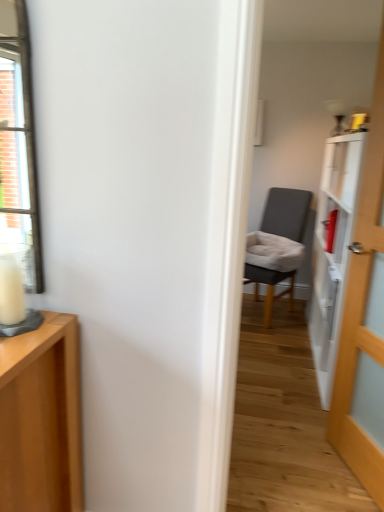
At what (x,y) coordinates should I click in order to perform the action: click on dark gray fabric chair at center. Please return your answer as a coordinate pair (x, y). Looking at the image, I should click on (286, 213).

The width and height of the screenshot is (384, 512). Identify the location of wooden door at right. (364, 314).

In order to face white wax candle at left, should I rotate leftwards or rightwards?

A 23.315 degree turn to the left will do.

Find the location of `dark gray fabric chair at center`. dark gray fabric chair at center is located at coordinates (286, 213).

Could you tell me if white wax candle at left is facing dark gray fabric chair at center?

No, white wax candle at left is not facing towards dark gray fabric chair at center.

Can you confirm if white wax candle at left is positioned to the right of dark gray fabric chair at center?

In fact, white wax candle at left is to the left of dark gray fabric chair at center.

How many degrees apart are the facing directions of white wax candle at left and dark gray fabric chair at center?

white wax candle at left and dark gray fabric chair at center are facing 28 degrees away from each other.

In terms of height, does white wax candle at left look taller or shorter compared to dark gray fabric chair at center?

In the image, white wax candle at left appears to be shorter than dark gray fabric chair at center.

Is wooden door at right facing away from white wax candle at left?

No, wooden door at right is not facing the opposite direction of white wax candle at left.

Does wooden door at right have a larger size compared to white wax candle at left?

Yes.

Can you confirm if wooden door at right is taller than white wax candle at left?

Correct, wooden door at right is much taller as white wax candle at left.

Locate an element on the screen. door located on the right of white wax candle at left is located at coordinates (364, 314).

Which object is further away from the camera taking this photo, dark gray fabric chair at center or white wax candle at left?

dark gray fabric chair at center.

Can you confirm if dark gray fabric chair at center is taller than white wax candle at left?

Yes, dark gray fabric chair at center is taller than white wax candle at left.

Which point is more distant from viewer, (271,304) or (11,265)?

The point (271,304) is farther from the camera.

Which of these two, dark gray fabric chair at center or white wax candle at left, is smaller?

Smaller between the two is white wax candle at left.

How many degrees apart are the facing directions of dark gray fabric chair at center and wooden door at right?

The facing directions of dark gray fabric chair at center and wooden door at right are 39.6 degrees apart.

From a real-world perspective, is dark gray fabric chair at center positioned under wooden door at right based on gravity?

Indeed, from a real-world perspective, dark gray fabric chair at center is positioned beneath wooden door at right.

Is dark gray fabric chair at center bigger than wooden door at right?

Indeed, dark gray fabric chair at center has a larger size compared to wooden door at right.

Considering the points (268, 199) and (375, 122), which point is behind, point (268, 199) or point (375, 122)?

The point (268, 199) is farther.

Which of these two, white wax candle at left or wooden door at right, stands taller?

With more height is wooden door at right.

At what (x,y) coordinates should I click in order to perform the action: click on candle that appears below the wooden door at right (from the image's perspective). Please return your answer as a coordinate pair (x, y). Looking at the image, I should click on (11, 292).

How different are the orientations of white wax candle at left and wooden door at right in degrees?

The angle between the facing direction of white wax candle at left and the facing direction of wooden door at right is 67.6 degrees.

Between wooden door at right and dark gray fabric chair at center, which one appears on the left side from the viewer's perspective?

dark gray fabric chair at center.

From the image's perspective, between wooden door at right and dark gray fabric chair at center, who is located below?

From the image's view, wooden door at right is below.

Measure the distance between wooden door at right and dark gray fabric chair at center.

They are 1.86 meters apart.

Would you consider wooden door at right to be distant from dark gray fabric chair at center?

Yes, wooden door at right and dark gray fabric chair at center are located far from each other.

Image resolution: width=384 pixels, height=512 pixels. What are the coordinates of `chair behind the white wax candle at left` in the screenshot? It's located at (286, 213).

In the image, there is a white wax candle at left. Where is `door above it (from the image's perspective)`? Image resolution: width=384 pixels, height=512 pixels. door above it (from the image's perspective) is located at coordinates coord(364,314).

In the scene shown: When comparing their distances from dark gray fabric chair at center, does white wax candle at left or wooden door at right seem closer?

wooden door at right lies closer to dark gray fabric chair at center than the other object.

Estimate the real-world distances between objects in this image. Which object is further from white wax candle at left, wooden door at right or dark gray fabric chair at center?

Among the two, dark gray fabric chair at center is located further to white wax candle at left.

From the image, which object appears to be farther from dark gray fabric chair at center, wooden door at right or white wax candle at left?

white wax candle at left.

Based on their spatial positions, is dark gray fabric chair at center or white wax candle at left closer to wooden door at right?

Among the two, white wax candle at left is located nearer to wooden door at right.

Estimate the real-world distances between objects in this image. Which object is further from wooden door at right, white wax candle at left or dark gray fabric chair at center?

dark gray fabric chair at center is further to wooden door at right.

From the image, which object appears to be nearer to white wax candle at left, dark gray fabric chair at center or wooden door at right?

Based on the image, wooden door at right appears to be nearer to white wax candle at left.

Identify the location of door between white wax candle at left and dark gray fabric chair at center along the z-axis. This screenshot has width=384, height=512. (364, 314).